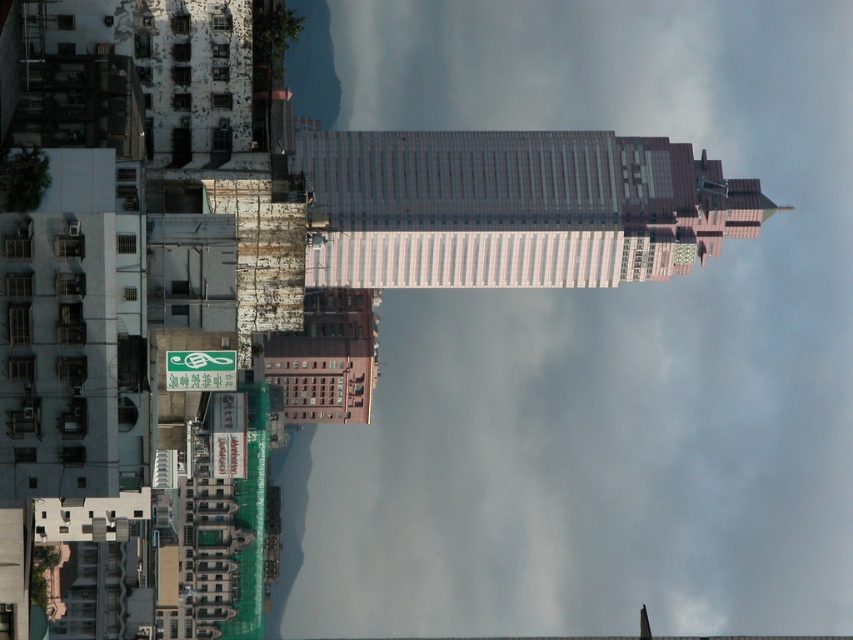
You are an architect reviewing a city blueprint. The blueprint shows a point at coordinates (595, 344). Based on the image, which structure does this point belong to?

The point at coordinates (595, 344) is on the transparent glass skyscraper at center, so the point belongs to the transparent glass skyscraper at center.

You are a city planner assessing the distance between two skyscrapers in the image. The transparent glass skyscraper at center and the light gray glass skyscraper at center are both part of a new development project. Given that the minimum required distance between any two buildings in the project is 200 feet, does this pair meet the safety regulation requirement?

The transparent glass skyscraper at center and the light gray glass skyscraper at center are 190.56 feet apart, which is less than the required 200 feet. Therefore, this pair does not meet the safety regulation requirement.